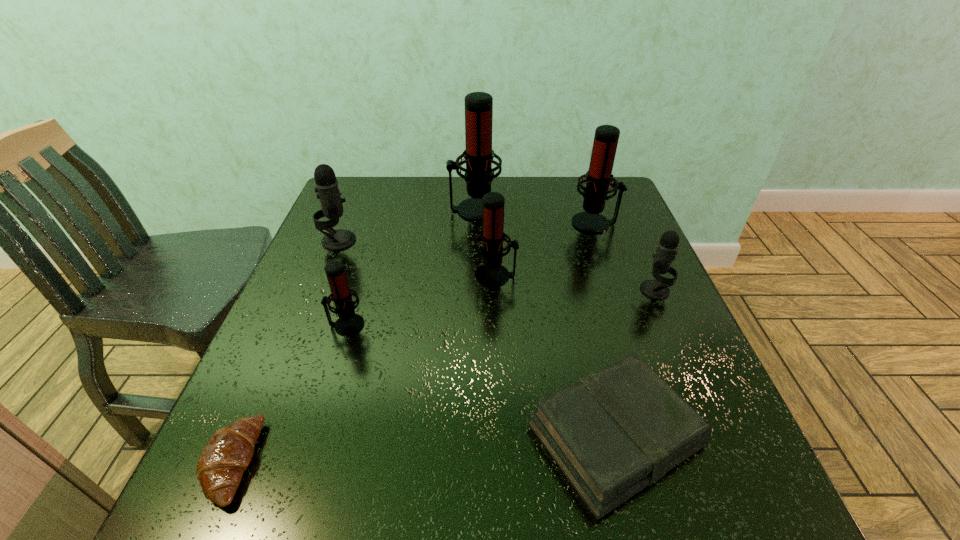
The image size is (960, 540). What are the coordinates of `the tallest microphone` in the screenshot? It's located at (478, 155).

The height and width of the screenshot is (540, 960). What are the coordinates of `the biggest red microphone` in the screenshot? It's located at (478, 155).

The image size is (960, 540). I want to click on the rightmost red microphone, so click(x=598, y=179).

This screenshot has width=960, height=540. In order to click on the second biggest red microphone in this screenshot , I will do `click(598, 179)`.

Locate an element on the screen. The image size is (960, 540). the leftmost microphone is located at coordinates (326, 183).

The width and height of the screenshot is (960, 540). Find the location of `the left black microphone`. the left black microphone is located at coordinates (326, 183).

What are the coordinates of `the third farthest red microphone` in the screenshot? It's located at (491, 273).

Locate an element on the screen. Image resolution: width=960 pixels, height=540 pixels. the leftmost red microphone is located at coordinates (349, 323).

In order to click on the second microphone from left to right in this screenshot , I will do `click(349, 323)`.

Where is `the right black microphone`? the right black microphone is located at coordinates (666, 251).